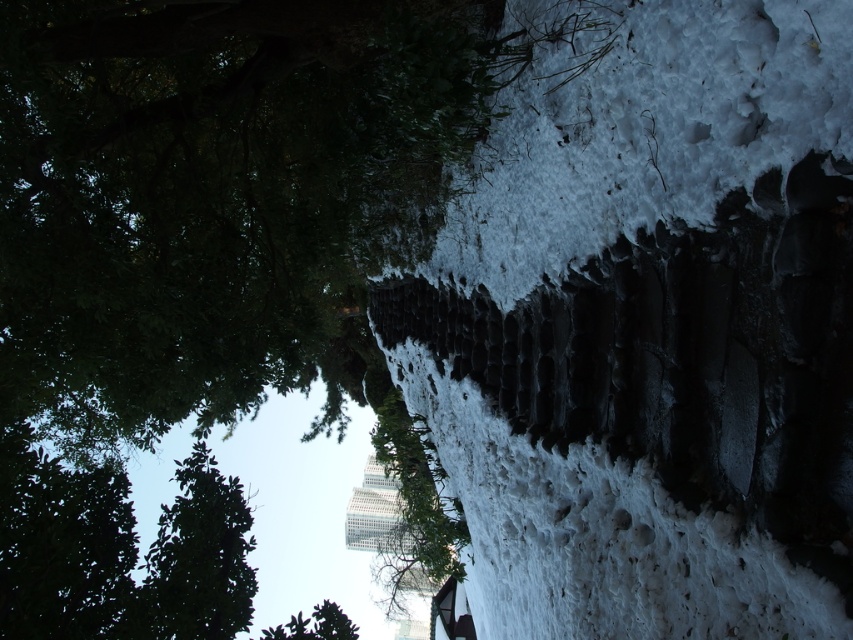
Question: Does white fluffy snow at center come in front of white fluffy snow at upper right?

Choices:
 (A) no
 (B) yes

Answer: (B)

Question: Which of the following is the farthest from the observer?

Choices:
 (A) (485, 612)
 (B) (93, 502)
 (C) (604, 76)

Answer: (A)

Question: Among these objects, which one is nearest to the camera?

Choices:
 (A) white fluffy snow at center
 (B) green leafy tree at upper left
 (C) white fluffy snow at upper right

Answer: (A)

Question: Is white fluffy snow at center above white fluffy snow at upper right?

Choices:
 (A) yes
 (B) no

Answer: (B)

Question: Observing the image, what is the correct spatial positioning of white fluffy snow at upper right in reference to green leafy tree at upper left?

Choices:
 (A) left
 (B) right

Answer: (B)

Question: Which object appears closest to the camera in this image?

Choices:
 (A) white fluffy snow at upper right
 (B) green leafy tree at upper left

Answer: (A)